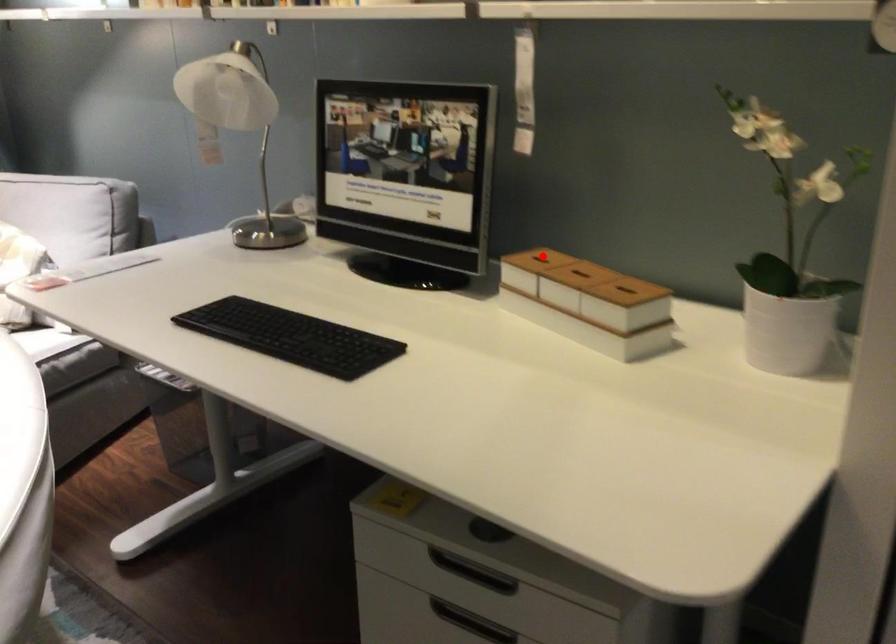
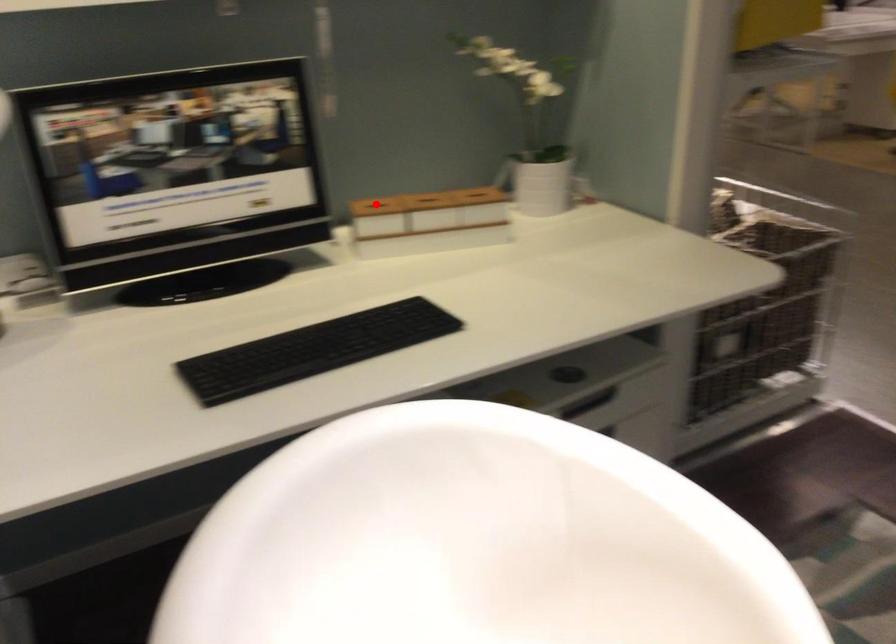
Looking at this image, I am providing you with two images of the same scene from different viewpoints. A red point is marked on the first image and another point is marked on the second image. Is the red point in image1 aligned with the point shown in image2?

Yes